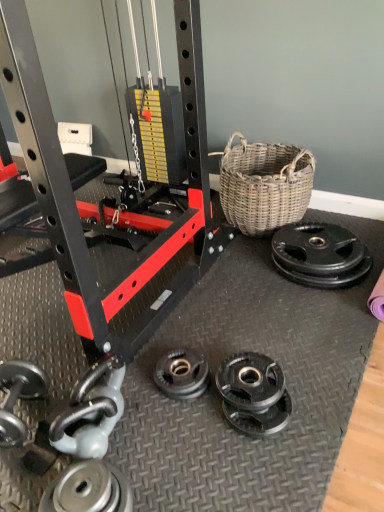
This screenshot has width=384, height=512. I want to click on free area behind silver metallic dumbbell at lower left, so click(x=125, y=373).